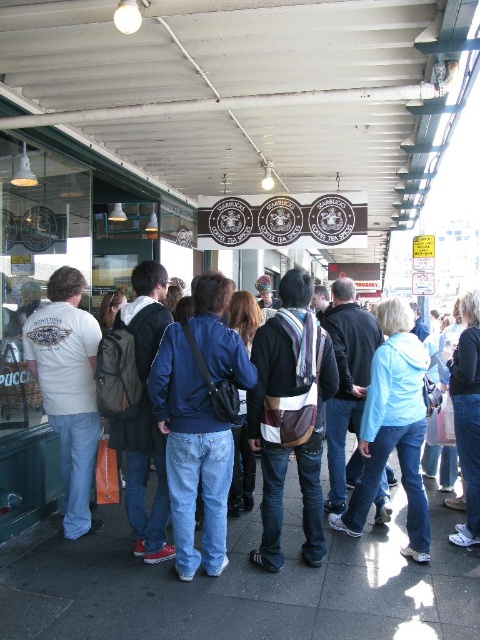
Question: Is blue denim jeans at center to the left of white t-shirt at left from the viewer's perspective?

Choices:
 (A) yes
 (B) no

Answer: (B)

Question: Which point is farther from the camera taking this photo?

Choices:
 (A) (217, 541)
 (B) (70, 314)

Answer: (B)

Question: Can you confirm if blue denim jeans at center is wider than white t-shirt at left?

Choices:
 (A) no
 (B) yes

Answer: (B)

Question: Considering the relative positions of blue denim jeans at center and white t-shirt at left in the image provided, where is blue denim jeans at center located with respect to white t-shirt at left?

Choices:
 (A) above
 (B) below

Answer: (B)

Question: Among these objects, which one is nearest to the camera?

Choices:
 (A) blue denim jeans at center
 (B) white t-shirt at left

Answer: (A)